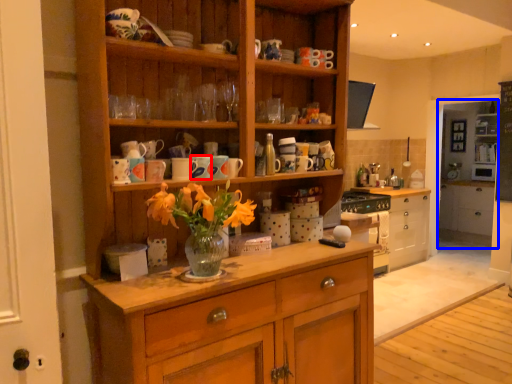
Question: Which object is further to the camera taking this photo, mug (highlighted by a red box) or shelf (highlighted by a blue box)?

Choices:
 (A) mug
 (B) shelf

Answer: (B)